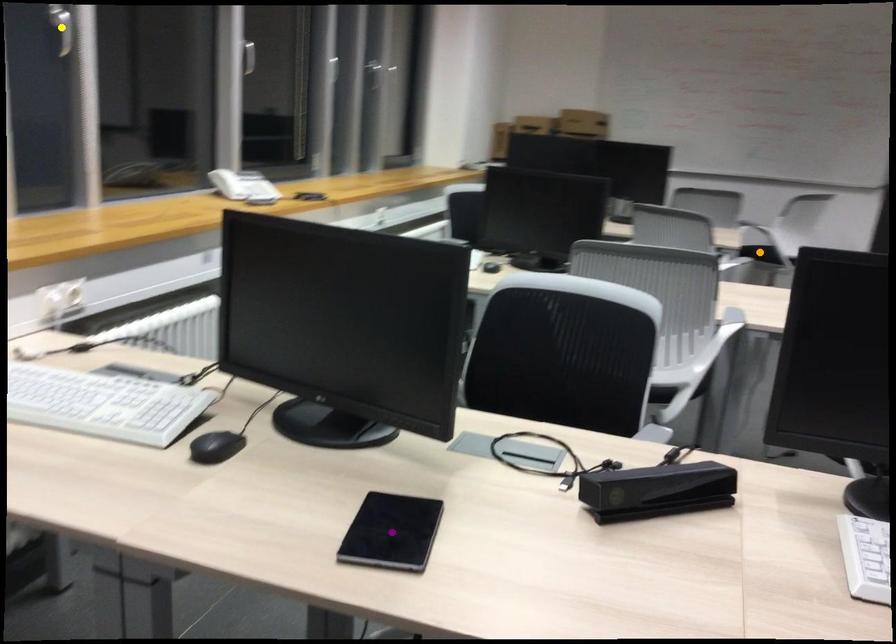
Order these from nearest to farthest:
orange point | purple point | yellow point

orange point → yellow point → purple point